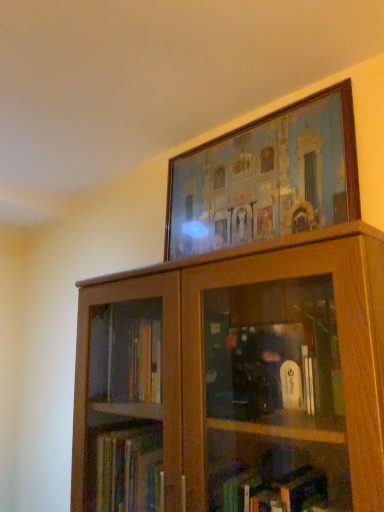
Find the location of a particular element. free space above wooden picture frame at upper center (from a real-world perspective) is located at coordinates (243, 123).